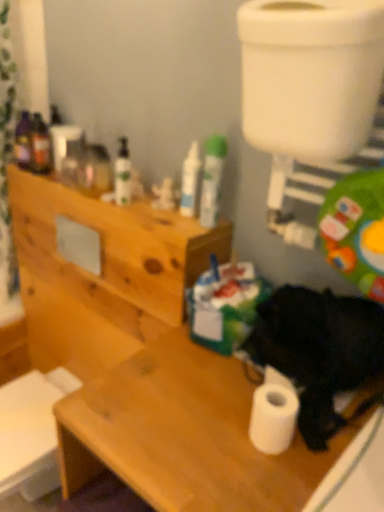
The height and width of the screenshot is (512, 384). What do you see at coordinates (212, 179) in the screenshot?
I see `white matte tube at center, which appears as the 1th toiletry when viewed from the right` at bounding box center [212, 179].

What do you see at coordinates (310, 75) in the screenshot? I see `white glossy toilet bowl at upper right` at bounding box center [310, 75].

The image size is (384, 512). What do you see at coordinates (319, 350) in the screenshot?
I see `black fur dog at lower right` at bounding box center [319, 350].

Describe the element at coordinates (184, 435) in the screenshot. I see `wooden desk at lower right` at that location.

Measure the distance between point (76, 206) and camera.

4.40 feet.

The height and width of the screenshot is (512, 384). Describe the element at coordinates (103, 273) in the screenshot. I see `wooden cabinet at upper left` at that location.

I want to click on matte green bottle at upper center, which appears as the third toiletry when viewed from the right, so click(x=122, y=173).

The height and width of the screenshot is (512, 384). What are the coordinates of `cabinetry below the matte green bottle at upper center, which appears as the 1th toiletry when viewed from the left (from a real-world perspective)` in the screenshot? It's located at tap(103, 273).

Can you confirm if matte green bottle at upper center, which appears as the 1th toiletry when viewed from the left, is taller than wooden cabinet at upper left?

No.

Based on the photo, from the image's perspective, which object appears higher, matte green bottle at upper center, which appears as the third toiletry when viewed from the right, or wooden cabinet at upper left?

matte green bottle at upper center, which appears as the third toiletry when viewed from the right, from the image's perspective.

Are white glossy tube at upper center, which is counted as the 2th toiletry, starting from the left, and black fur dog at lower right making contact?

white glossy tube at upper center, which is counted as the 2th toiletry, starting from the left, and black fur dog at lower right are clearly separated.

Which object is further away from the camera taking this photo, white glossy tube at upper center, which is counted as the 2th toiletry, starting from the left, or black fur dog at lower right?

white glossy tube at upper center, which is counted as the 2th toiletry, starting from the left, is further away from the camera.

Considering the positions of point (196, 144) and point (315, 293), is point (196, 144) closer or farther from the camera than point (315, 293)?

Point (196, 144) is positioned farther from the camera compared to point (315, 293).

Can you confirm if white glossy tube at upper center, the 2th toiletry when ordered from right to left, is bigger than black fur dog at lower right?

No, white glossy tube at upper center, the 2th toiletry when ordered from right to left, is not bigger than black fur dog at lower right.

Is white glossy toilet bowl at upper right at the left side of white glossy tube at upper center, the 2th toiletry when ordered from right to left?

No, white glossy toilet bowl at upper right is not to the left of white glossy tube at upper center, the 2th toiletry when ordered from right to left.

Would you say white glossy toilet bowl at upper right contains white glossy tube at upper center, the 2th toiletry when ordered from right to left?

No, white glossy toilet bowl at upper right does not contain white glossy tube at upper center, the 2th toiletry when ordered from right to left.

Who is shorter, white glossy toilet bowl at upper right or white glossy tube at upper center, the 2th toiletry when ordered from right to left?

Standing shorter between the two is white glossy tube at upper center, the 2th toiletry when ordered from right to left.

Which is in front, point (281, 31) or point (194, 146)?

The point (281, 31) is in front.

From a real-world perspective, between wooden cabinet at upper left and white glossy tube at upper center, which is counted as the 2th toiletry, starting from the left, who is vertically lower?

wooden cabinet at upper left.

Between wooden cabinet at upper left and white glossy tube at upper center, the 2th toiletry when ordered from right to left, which one has larger size?

With larger size is wooden cabinet at upper left.

Could white glossy tube at upper center, the 2th toiletry when ordered from right to left, be considered to be inside wooden cabinet at upper left?

No.

Is wooden cabinet at upper left far from white glossy tube at upper center, which is counted as the 2th toiletry, starting from the left?

No, there isn't a large distance between wooden cabinet at upper left and white glossy tube at upper center, which is counted as the 2th toiletry, starting from the left.

I want to click on desk on the left of black fur dog at lower right, so click(184, 435).

Is black fur dog at lower right positioned beyond the bounds of wooden desk at lower right?

black fur dog at lower right is positioned outside wooden desk at lower right.

From the image's perspective, relative to wooden desk at lower right, is black fur dog at lower right above or below?

Based on their image positions, black fur dog at lower right is located above wooden desk at lower right.

Considering the points (212, 193) and (166, 489), which point is behind, point (212, 193) or point (166, 489)?

The point (212, 193) is farther from the camera.

Is white matte tube at center, which appears as the 1th toiletry when viewed from the right, surrounding wooden desk at lower right?

No, wooden desk at lower right is not inside white matte tube at center, which appears as the 1th toiletry when viewed from the right.

Can you confirm if white matte tube at center, the 3th toiletry from the left, is thinner than wooden desk at lower right?

Yes, white matte tube at center, the 3th toiletry from the left, is thinner than wooden desk at lower right.

From the image's perspective, is white glossy toilet bowl at upper right located beneath wooden cabinet at upper left?

No, from the image's perspective, white glossy toilet bowl at upper right is not below wooden cabinet at upper left.

Considering the relative sizes of white glossy toilet bowl at upper right and wooden cabinet at upper left in the image provided, is white glossy toilet bowl at upper right bigger than wooden cabinet at upper left?

No.

Would you consider white glossy toilet bowl at upper right to be distant from wooden cabinet at upper left?

white glossy toilet bowl at upper right is near wooden cabinet at upper left, not far away.

Locate an element on the screen. The image size is (384, 512). the 2nd toiletry behind when counting from the wooden cabinet at upper left is located at coordinates (122, 173).

Where is `animal below the white glossy tube at upper center, which is counted as the 2th toiletry, starting from the left (from the image's perspective)`? The height and width of the screenshot is (512, 384). animal below the white glossy tube at upper center, which is counted as the 2th toiletry, starting from the left (from the image's perspective) is located at coordinates (319, 350).

Considering their positions, is white matte tube at center, the 3th toiletry from the left, positioned closer to wooden desk at lower right than white glossy toilet bowl at upper right?

The object closer to wooden desk at lower right is white matte tube at center, the 3th toiletry from the left.

From the image, which object appears to be farther from wooden desk at lower right, white glossy tube at upper center, which is counted as the 2th toiletry, starting from the left, or black fur dog at lower right?

white glossy tube at upper center, which is counted as the 2th toiletry, starting from the left, lies further to wooden desk at lower right than the other object.

Which object lies further to the anchor point white matte tube at center, which appears as the 1th toiletry when viewed from the right, wooden desk at lower right or wooden cabinet at upper left?

wooden desk at lower right is further to white matte tube at center, which appears as the 1th toiletry when viewed from the right.

From the image, which object appears to be nearer to black fur dog at lower right, white glossy toilet bowl at upper right or white glossy tube at upper center, the 2th toiletry when ordered from right to left?

Among the two, white glossy toilet bowl at upper right is located nearer to black fur dog at lower right.

When comparing their distances from matte green bottle at upper center, which appears as the third toiletry when viewed from the right, does wooden cabinet at upper left or white glossy tube at upper center, the 2th toiletry when ordered from right to left, seem further?

Based on the image, wooden cabinet at upper left appears to be further to matte green bottle at upper center, which appears as the third toiletry when viewed from the right.

Looking at the image, which one is located further to white glossy tube at upper center, the 2th toiletry when ordered from right to left, white matte tube at center, which appears as the 1th toiletry when viewed from the right, or black fur dog at lower right?

black fur dog at lower right is further to white glossy tube at upper center, the 2th toiletry when ordered from right to left.

When comparing their distances from white glossy toilet bowl at upper right, does wooden desk at lower right or black fur dog at lower right seem closer?

Among the two, black fur dog at lower right is located nearer to white glossy toilet bowl at upper right.

Consider the image. Estimate the real-world distances between objects in this image. Which object is further from black fur dog at lower right, white matte tube at center, which appears as the 1th toiletry when viewed from the right, or white glossy toilet bowl at upper right?

white glossy toilet bowl at upper right lies further to black fur dog at lower right than the other object.

This screenshot has height=512, width=384. Find the location of `desk between wooden cabinet at upper left and black fur dog at lower right`. desk between wooden cabinet at upper left and black fur dog at lower right is located at coordinates (184, 435).

Locate an element on the screen. Image resolution: width=384 pixels, height=512 pixels. cabinetry located between white glossy toilet bowl at upper right and white glossy tube at upper center, the 2th toiletry when ordered from right to left, in the depth direction is located at coordinates (103, 273).

Locate an element on the screen. This screenshot has height=512, width=384. toiletry between black fur dog at lower right and white glossy tube at upper center, which is counted as the 2th toiletry, starting from the left, in the front-back direction is located at coordinates (212, 179).

The image size is (384, 512). Find the location of `cabinetry that lies between white glossy tube at upper center, which is counted as the 2th toiletry, starting from the left, and wooden desk at lower right from top to bottom`. cabinetry that lies between white glossy tube at upper center, which is counted as the 2th toiletry, starting from the left, and wooden desk at lower right from top to bottom is located at coordinates (103, 273).